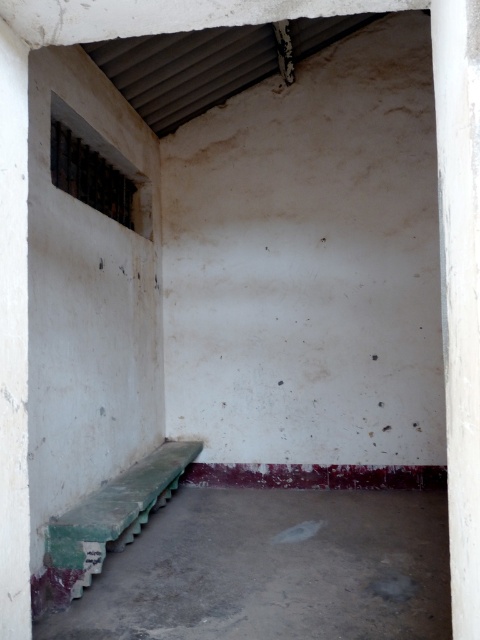
Is white concrete pillar at left to the right of green painted wood bench at lower left from the viewer's perspective?

Incorrect, white concrete pillar at left is not on the right side of green painted wood bench at lower left.

Between point (4, 600) and point (108, 524), which one is positioned behind?

Point (108, 524)

Does point (2, 116) come farther from viewer compared to point (84, 500)?

No.

Where is `white concrete pillar at left`? white concrete pillar at left is located at coordinates (13, 330).

Is green painted concrete bench at lower left above white concrete pillar at left?

Actually, green painted concrete bench at lower left is below white concrete pillar at left.

Between green painted concrete bench at lower left and white concrete pillar at left, which one has more height?

With more height is white concrete pillar at left.

Based on the photo, who is more forward, (297, 552) or (7, 13)?

Point (7, 13)

Where is `green painted concrete bench at lower left`? The height and width of the screenshot is (640, 480). green painted concrete bench at lower left is located at coordinates tap(274, 570).

Does green painted concrete bench at lower left appear on the right side of white smooth pillar at right?

Incorrect, green painted concrete bench at lower left is not on the right side of white smooth pillar at right.

Is point (213, 609) positioned behind point (453, 218)?

Yes, point (213, 609) is farther from viewer.

Is point (404, 618) positioned before point (476, 608)?

That is False.

Where is `green painted concrete bench at lower left`? This screenshot has width=480, height=640. green painted concrete bench at lower left is located at coordinates (274, 570).